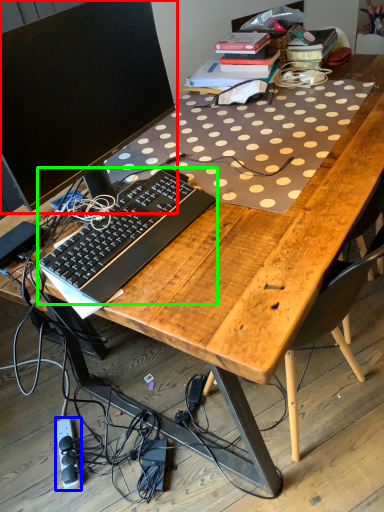
Question: Considering the real-world distances, which object is closest to computer monitor (highlighted by a red box)? equipment (highlighted by a blue box) or computer keyboard (highlighted by a green box).

Choices:
 (A) equipment
 (B) computer keyboard

Answer: (B)